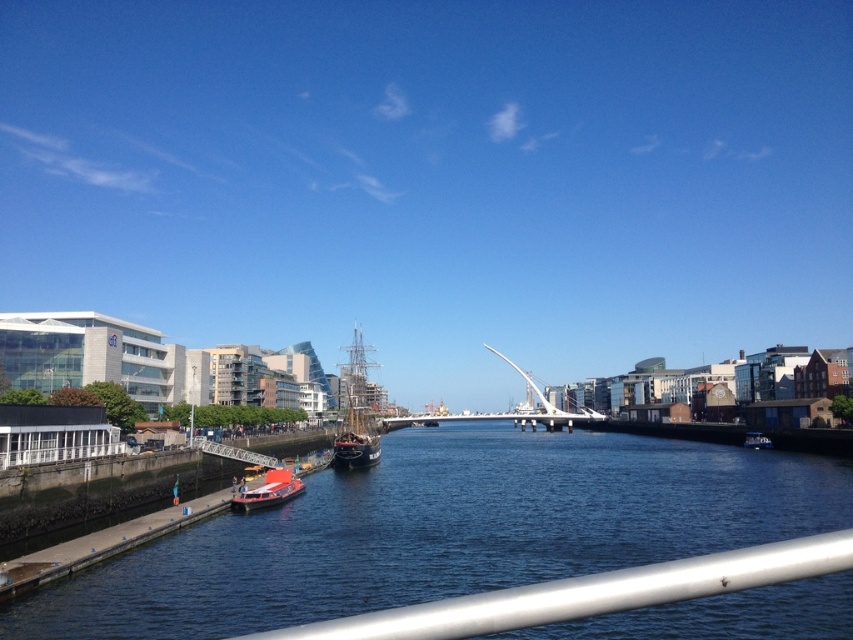
Question: Which of the following is the closest to the observer?

Choices:
 (A) (369, 365)
 (B) (796, 541)

Answer: (B)

Question: Is blue water at lower left above silver metallic railing at lower center?

Choices:
 (A) no
 (B) yes

Answer: (A)

Question: Observing the image, what is the correct spatial positioning of silver metallic railing at lower center in reference to wooden ship at center?

Choices:
 (A) above
 (B) below

Answer: (B)

Question: Is wooden ship at center closer to the viewer compared to white metallic bridge at center?

Choices:
 (A) no
 (B) yes

Answer: (B)

Question: Which is nearer to the blue water at lower left?

Choices:
 (A) red matte boat at lower left
 (B) white metallic bridge at center
 (C) silver metallic railing at lower center
 (D) wooden ship at center

Answer: (A)

Question: Which object appears closest to the camera in this image?

Choices:
 (A) white metallic bridge at center
 (B) blue water at lower left
 (C) red matte boat at lower left
 (D) silver metallic railing at lower center

Answer: (D)